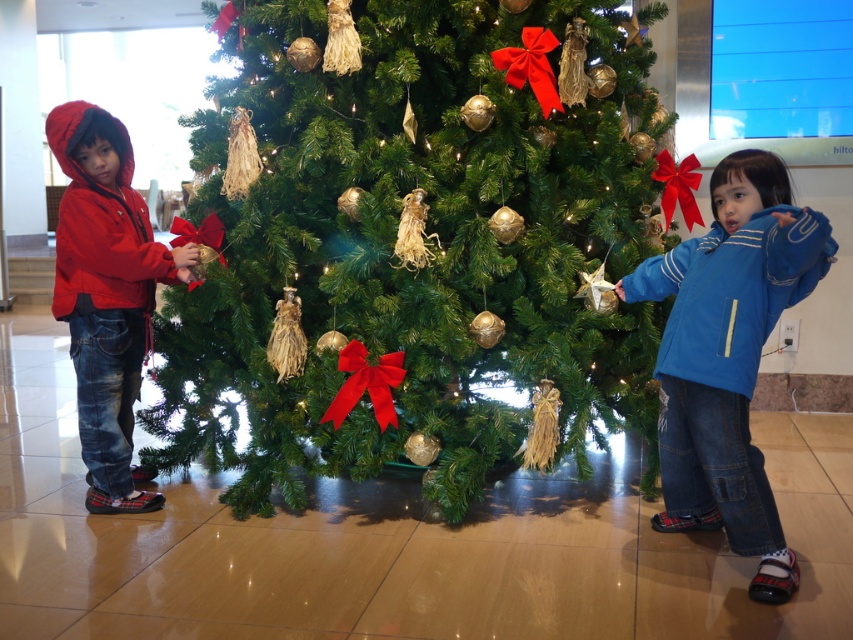
You are standing in the room where the Christmas tree is located. You want to place a new ornament exactly at the point with coordinates point (425, 244). Which object will this ornament be placed on?

The point (425, 244) corresponds to the green matte christmas tree at center, so the ornament will be placed on the green matte christmas tree at center.

You are a parent trying to choose a coat for your child based on the image. The blue fleece jacket at right and the matte red jacket at left are both available. If you want the coat to reach the child

The blue fleece jacket at right is not as tall as matte red jacket at left, so the matte red jacket at left would be the better choice to ensure the coat reaches the child properly.

You are a parent who wants to ensure the Christmas tree is tall enough to hide a gift box placed behind it. The gift box is the same height as the blue fleece jacket at right. Based on the scene, will the green matte christmas tree at center conceal the gift box when placed behind it?

The green matte christmas tree at center has a greater height compared to the blue fleece jacket at right. Since the gift box is the same height as the blue fleece jacket at right, the tree will be taller and can conceal the gift box placed behind it.